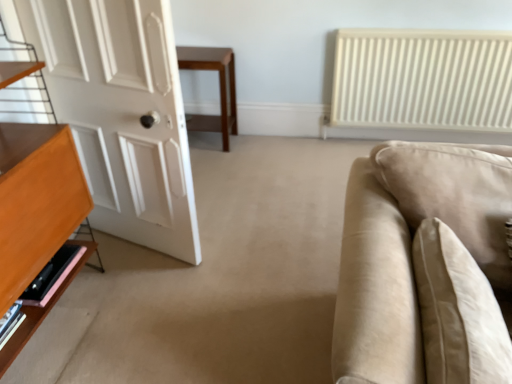
Question: Looking at their shapes, would you say beige fabric pillow at right is wider or thinner than wooden table at center?

Choices:
 (A) wide
 (B) thin

Answer: (A)

Question: Is point (478, 286) positioned closer to the camera than point (184, 66)?

Choices:
 (A) farther
 (B) closer

Answer: (B)

Question: Which is nearer to the beige fabric couch at right?

Choices:
 (A) pink wood shelf at lower left
 (B) wooden table at center
 (C) white matte door at left
 (D) beige fabric pillow at right

Answer: (D)

Question: Based on their relative distances, which object is nearer to the wooden table at center?

Choices:
 (A) pink wood shelf at lower left
 (B) beige fabric pillow at right
 (C) beige fabric couch at right
 (D) white matte door at left

Answer: (D)